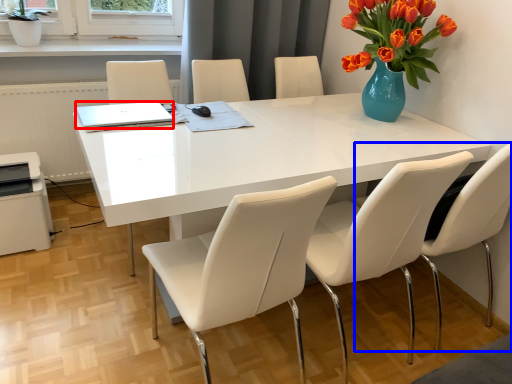
Question: Among these objects, which one is farthest to the camera, laptop (highlighted by a red box) or chair (highlighted by a blue box)?

Choices:
 (A) laptop
 (B) chair

Answer: (A)